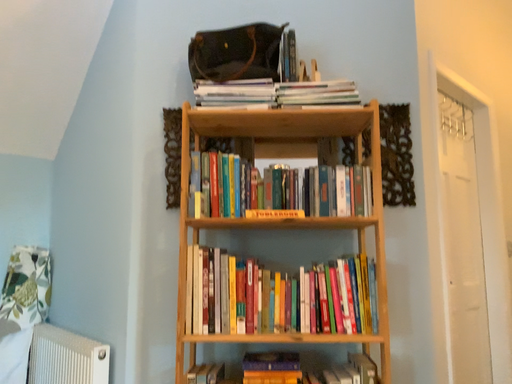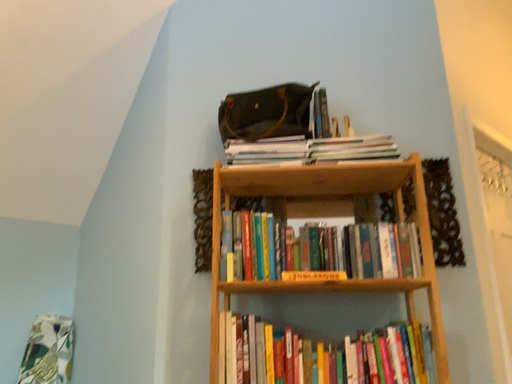
Question: Which way did the camera rotate in the video?

Choices:
 (A) rotated downward
 (B) rotated upward

Answer: (B)